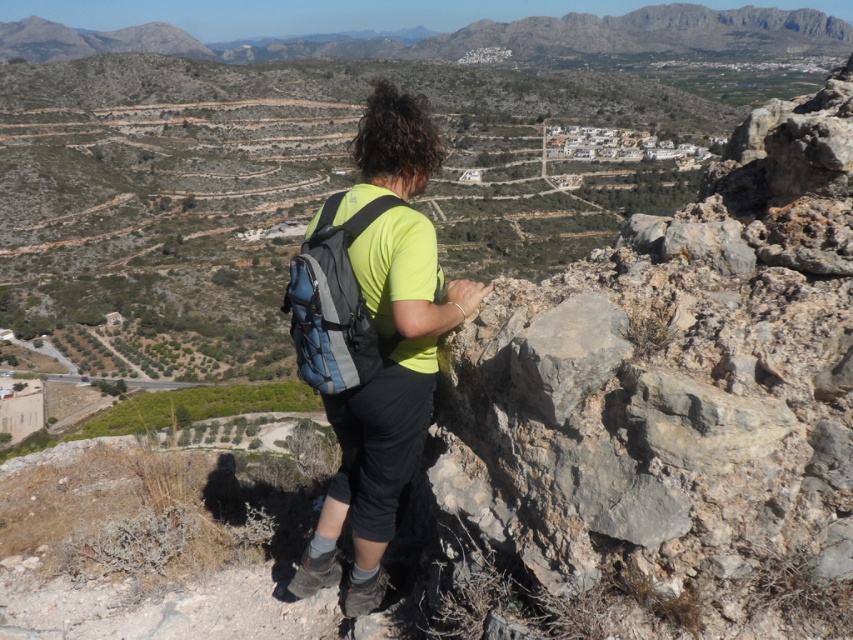
You are the hiker in the image. You need to retrieve your map from the green matte shirt at center to navigate. However, your matte blue backpack at center is blocking your access. Can you easily reach the map without moving the backpack?

The matte blue backpack at center is behind the green matte shirt at center, so it is not blocking the front of the shirt. You can easily reach the map on the green matte shirt at center without moving the backpack.